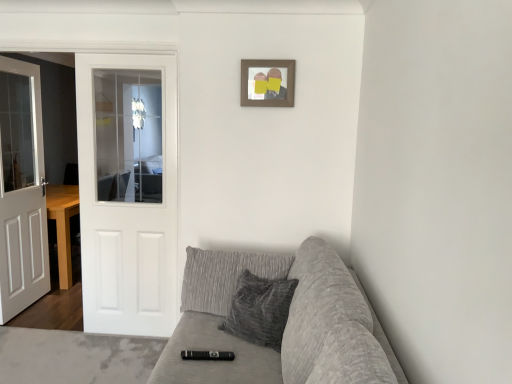
This screenshot has width=512, height=384. What do you see at coordinates (207, 355) in the screenshot?
I see `black plastic remote at center` at bounding box center [207, 355].

What is the approximate width of wooden picture frame at upper center?

The width of wooden picture frame at upper center is 1.19 inches.

Describe the element at coordinates (21, 190) in the screenshot. I see `white wooden door at left, which is counted as the first door, starting from the left` at that location.

This screenshot has height=384, width=512. Find the location of `textured gray couch at lower right`. textured gray couch at lower right is located at coordinates (286, 325).

Locate an element on the screen. The image size is (512, 384). white glossy door at left, the 2th door positioned from the left is located at coordinates (128, 192).

Is white glossy door at left, positioned as the 1th door in right-to-left order, at the back of white wooden door at left, which is counted as the first door, starting from the left?

No, white wooden door at left, which is counted as the first door, starting from the left,'s orientation is not away from white glossy door at left, positioned as the 1th door in right-to-left order.

Does point (4, 279) come farther from viewer compared to point (147, 60)?

Yes, point (4, 279) is farther from viewer.

What's the angular difference between white wooden door at left, which is counted as the first door, starting from the left, and white glossy door at left, positioned as the 1th door in right-to-left order,'s facing directions?

91.5 degrees separate the facing orientations of white wooden door at left, which is counted as the first door, starting from the left, and white glossy door at left, positioned as the 1th door in right-to-left order.

From the image's perspective, between wooden picture frame at upper center and white wooden door at left, which is counted as the first door, starting from the left, who is located below?

white wooden door at left, which is counted as the first door, starting from the left, appears lower in the image.

Is wooden picture frame at upper center oriented away from white wooden door at left, which is counted as the first door, starting from the left?

No.

Does wooden picture frame at upper center come behind white wooden door at left, marked as the 2th door in a right-to-left arrangement?

No.

In terms of height, does wooden picture frame at upper center look taller or shorter compared to white wooden door at left, marked as the 2th door in a right-to-left arrangement?

Considering their sizes, wooden picture frame at upper center has less height than white wooden door at left, marked as the 2th door in a right-to-left arrangement.

Between black plastic remote at center and wooden picture frame at upper center, which one appears on the left side from the viewer's perspective?

Positioned to the left is black plastic remote at center.

From a real-world perspective, is black plastic remote at center positioned above or below wooden picture frame at upper center?

black plastic remote at center is below wooden picture frame at upper center.

Is black plastic remote at center taller or shorter than wooden picture frame at upper center?

black plastic remote at center is shorter than wooden picture frame at upper center.

Image resolution: width=512 pixels, height=384 pixels. What are the coordinates of `picture frame that is behind the black plastic remote at center` in the screenshot? It's located at (267, 83).

How much distance is there between black plastic remote at center and white glossy door at left, positioned as the 1th door in right-to-left order?

black plastic remote at center is 3.64 meters from white glossy door at left, positioned as the 1th door in right-to-left order.

Does point (191, 354) lie behind point (146, 168)?

That is False.

From their relative heights in the image, would you say black plastic remote at center is taller or shorter than white glossy door at left, the 2th door positioned from the left?

Clearly, black plastic remote at center is shorter compared to white glossy door at left, the 2th door positioned from the left.

From a real-world perspective, who is located higher, black plastic remote at center or white glossy door at left, positioned as the 1th door in right-to-left order?

white glossy door at left, positioned as the 1th door in right-to-left order, is physically above.

From the image's perspective, is white glossy door at left, positioned as the 1th door in right-to-left order, over textured gray couch at lower right?

Yes.

Is white glossy door at left, the 2th door positioned from the left, facing away from textured gray couch at lower right?

No.

Consider the image. Is white glossy door at left, the 2th door positioned from the left, to the left or to the right of textured gray couch at lower right in the image?

white glossy door at left, the 2th door positioned from the left, is to the left of textured gray couch at lower right.

Which object is thinner, white glossy door at left, the 2th door positioned from the left, or textured gray couch at lower right?

white glossy door at left, the 2th door positioned from the left.

Is textured gray couch at lower right inside wooden picture frame at upper center?

No, textured gray couch at lower right is not inside wooden picture frame at upper center.

Find the location of a particular element. picture frame located above the textured gray couch at lower right (from the image's perspective) is located at coordinates (267, 83).

From a real-world perspective, does wooden picture frame at upper center stand above textured gray couch at lower right?

Yes, from a real-world perspective, wooden picture frame at upper center is over textured gray couch at lower right

From a real-world perspective, is textured gray couch at lower right located beneath white glossy door at left, positioned as the 1th door in right-to-left order?

Correct, in the physical world, textured gray couch at lower right is lower than white glossy door at left, positioned as the 1th door in right-to-left order.

In terms of height, does textured gray couch at lower right look taller or shorter compared to white glossy door at left, the 2th door positioned from the left?

Considering their sizes, textured gray couch at lower right has less height than white glossy door at left, the 2th door positioned from the left.

The image size is (512, 384). Identify the location of the 1st door behind the textured gray couch at lower right, starting your count from the anchor. (128, 192).

At what (x,y) coordinates should I click in order to perform the action: click on door located above the white wooden door at left, marked as the 2th door in a right-to-left arrangement (from a real-world perspective). Please return your answer as a coordinate pair (x, y). The width and height of the screenshot is (512, 384). Looking at the image, I should click on (128, 192).

I want to click on door that is the 1st one when counting downward from the wooden picture frame at upper center (from the image's perspective), so click(x=21, y=190).

Looking at the image, which one is located further to white glossy door at left, positioned as the 1th door in right-to-left order, white wooden door at left, marked as the 2th door in a right-to-left arrangement, or black plastic remote at center?

Among the two, black plastic remote at center is located further to white glossy door at left, positioned as the 1th door in right-to-left order.

Which object lies further to the anchor point black plastic remote at center, textured gray couch at lower right or white wooden door at left, which is counted as the first door, starting from the left?

white wooden door at left, which is counted as the first door, starting from the left.

Looking at the image, which one is located further to white glossy door at left, positioned as the 1th door in right-to-left order, textured gray couch at lower right or white wooden door at left, which is counted as the first door, starting from the left?

textured gray couch at lower right lies further to white glossy door at left, positioned as the 1th door in right-to-left order, than the other object.

From the image, which object appears to be nearer to textured gray couch at lower right, wooden picture frame at upper center or white glossy door at left, the 2th door positioned from the left?

wooden picture frame at upper center.

Looking at the image, which one is located further to wooden picture frame at upper center, textured gray couch at lower right or white glossy door at left, positioned as the 1th door in right-to-left order?

white glossy door at left, positioned as the 1th door in right-to-left order.

Looking at the image, which one is located further to white wooden door at left, which is counted as the first door, starting from the left, white glossy door at left, the 2th door positioned from the left, or black plastic remote at center?

Among the two, black plastic remote at center is located further to white wooden door at left, which is counted as the first door, starting from the left.

Which object lies further to the anchor point wooden picture frame at upper center, black plastic remote at center or textured gray couch at lower right?

Among the two, black plastic remote at center is located further to wooden picture frame at upper center.

Estimate the real-world distances between objects in this image. Which object is further from white glossy door at left, positioned as the 1th door in right-to-left order, wooden picture frame at upper center or black plastic remote at center?

black plastic remote at center is positioned further to the anchor white glossy door at left, positioned as the 1th door in right-to-left order.

At what (x,y) coordinates should I click in order to perform the action: click on remote between white wooden door at left, which is counted as the first door, starting from the left, and textured gray couch at lower right. Please return your answer as a coordinate pair (x, y). Looking at the image, I should click on [207, 355].

Locate an element on the screen. remote between wooden picture frame at upper center and textured gray couch at lower right in the up-down direction is located at coordinates (207, 355).

Identify the location of studio couch between white wooden door at left, which is counted as the first door, starting from the left, and wooden picture frame at upper center from left to right. (286, 325).

Locate an element on the screen. door positioned between textured gray couch at lower right and white wooden door at left, which is counted as the first door, starting from the left, from near to far is located at coordinates (128, 192).